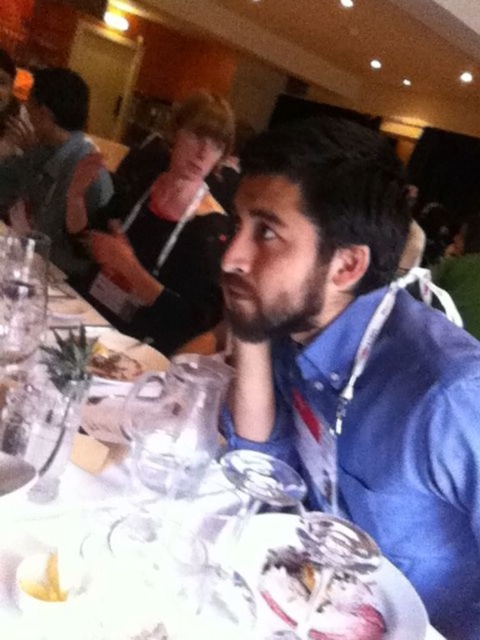
Question: Does white glossy plate at center appear over dark brown beard at center?

Choices:
 (A) no
 (B) yes

Answer: (A)

Question: Observing the image, what is the correct spatial positioning of blue cotton shirt at center in reference to brown crumbly cake at lower left?

Choices:
 (A) right
 (B) left

Answer: (A)

Question: Considering the real-world distances, which object is closest to the white glossy plate at center?

Choices:
 (A) dark brown beard at center
 (B) brown crumbly cake at lower left

Answer: (A)

Question: Which object is farther from the camera taking this photo?

Choices:
 (A) brown crumbly cake at lower left
 (B) white glossy plate at center

Answer: (A)

Question: Which object is farther from the camera taking this photo?

Choices:
 (A) dark brown beard at center
 (B) white glossy plate at center
 (C) yellow crispy potato at lower left
 (D) matte black shirt at upper left

Answer: (D)

Question: Can you confirm if matte black shirt at upper left is thinner than white glossy plate at center?

Choices:
 (A) no
 (B) yes

Answer: (A)